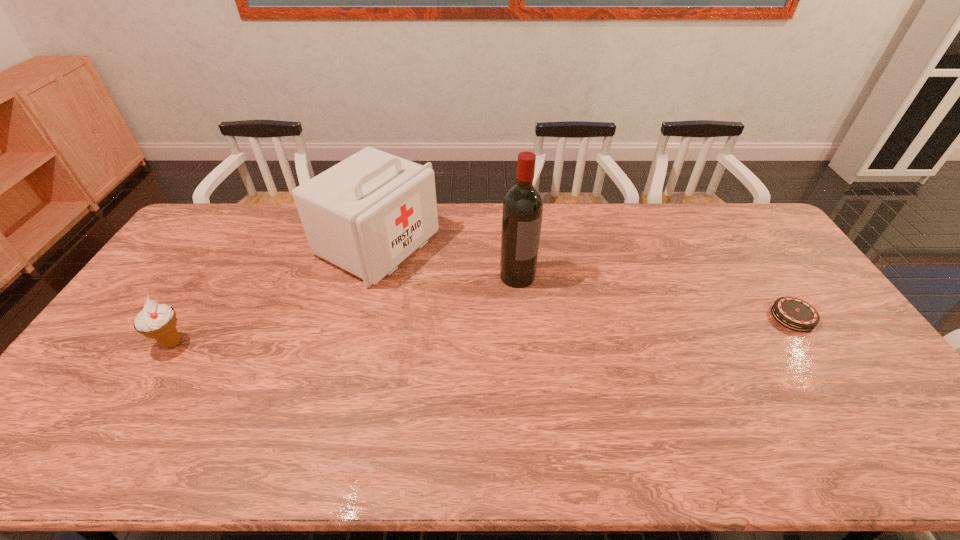
The height and width of the screenshot is (540, 960). What are the coordinates of `vacant space that is in between the third object from left to right and the third tallest object` in the screenshot? It's located at (346, 309).

Where is `free spot between the icecream and the chocolate cake`? free spot between the icecream and the chocolate cake is located at coordinates (483, 330).

You are a GUI agent. You are given a task and a screenshot of the screen. Output one action in this format:
    pyautogui.click(x=<x>, y=<y>)
    Task: Click on the free space that is in between the third shortest object and the rightmost object
    
    Given the screenshot: What is the action you would take?
    pyautogui.click(x=586, y=281)

This screenshot has width=960, height=540. In order to click on free point between the shortest object and the third object from left to right in this screenshot , I will do `click(655, 296)`.

The height and width of the screenshot is (540, 960). Find the location of `the second closest object to the second shortest object`. the second closest object to the second shortest object is located at coordinates (522, 212).

Point out which object is positioned as the nearest to the second tallest object. Please provide its 2D coordinates. Your answer should be formatted as a tuple, i.e. [(x, y)], where the tuple contains the x and y coordinates of a point satisfying the conditions above.

[(522, 212)]